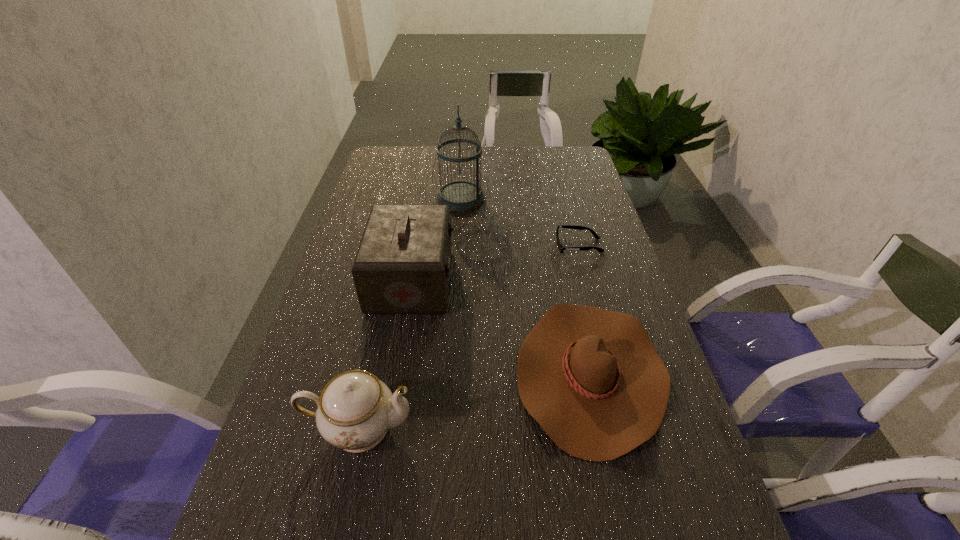
Image resolution: width=960 pixels, height=540 pixels. In the image, there is a desktop. Identify the location of free space at the far right corner. (550, 171).

Find the location of a particular element. This screenshot has width=960, height=540. blank region between the birdcage and the shortest object is located at coordinates (519, 222).

Image resolution: width=960 pixels, height=540 pixels. Find the location of `free space between the birdcage and the sunglasses`. free space between the birdcage and the sunglasses is located at coordinates (519, 222).

The image size is (960, 540). Find the location of `empty location between the first-aid kit and the chinaware`. empty location between the first-aid kit and the chinaware is located at coordinates (385, 354).

This screenshot has width=960, height=540. Identify the location of empty location between the second shortest object and the third tallest object. (474, 400).

Find the location of a particular element. vacant space in between the sunglasses and the third shortest object is located at coordinates 468,336.

The image size is (960, 540). In order to click on vacant area that lies between the chinaware and the second shortest object in this screenshot , I will do pos(474,400).

Locate an element on the screen. the second closest object to the fourth shortest object is located at coordinates (461, 195).

Locate which object ranks fourth in proximity to the first-aid kit. Please provide its 2D coordinates. Your answer should be formatted as a tuple, i.e. [(x, y)], where the tuple contains the x and y coordinates of a point satisfying the conditions above.

[(560, 247)]

Locate an element on the screen. The width and height of the screenshot is (960, 540). free point that satisfies the following two spatial constraints: 1. on the front side of the cowboy hat; 2. at the spout of the chinaware is located at coordinates (603, 428).